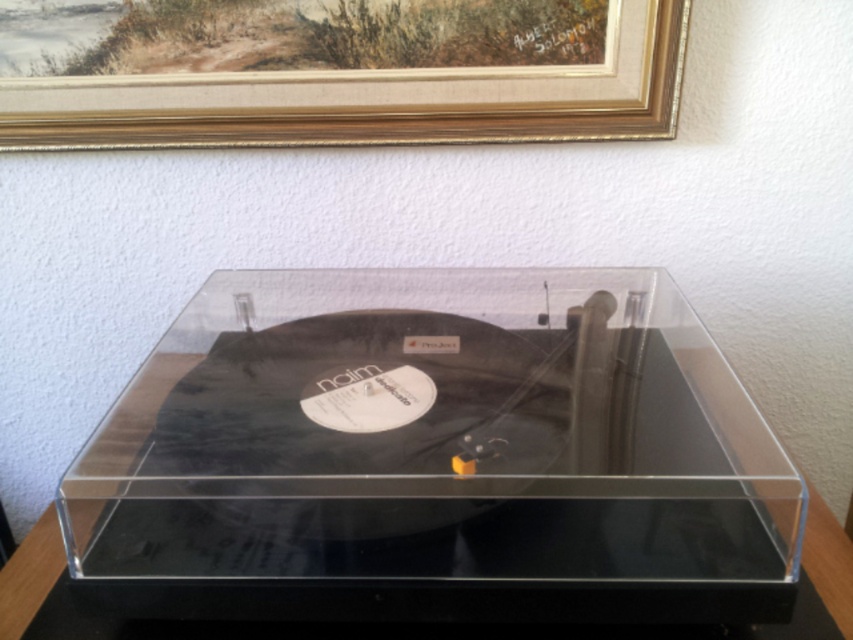
Who is positioned more to the left, transparent acrylic record player at center or gold wood picture frame at upper center?

gold wood picture frame at upper center is more to the left.

Which is behind, point (296, 349) or point (247, 125)?

Positioned behind is point (247, 125).

This screenshot has width=853, height=640. In order to click on transparent acrylic record player at center in this screenshot , I will do `click(436, 456)`.